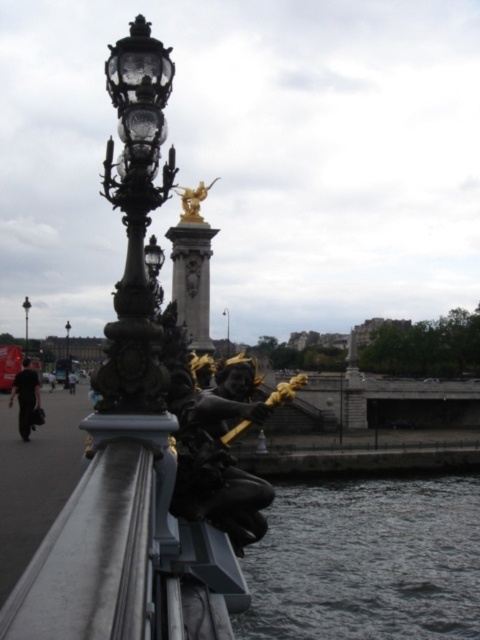
You are standing on the bridge and want to walk from point A to point B. Point A is at coordinates point (217, 230) and point B is at coordinates point (228, 337). Which direction should you walk to reach point B from point A?

To reach point B from point A, you should walk forward since point A is in front of point B.

From the picture: You are an architect assessing the structural integrity of the bridge. You notice the white marble column at center and the black glass street light at center. Which object is taller and might require additional support due to its height?

The white marble column at center is taller than the black glass street light at center, so it might require additional support due to its height.

You are an architect designing a new bridge and want to ensure that the white marble column at center and the black polished street light at upper left are proportionate. Based on the image, which object is taller?

The white marble column at center is taller than the black polished street light at upper left according to the description.